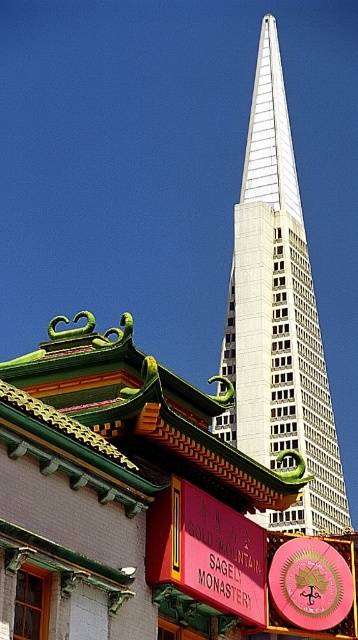
Question: Is white glass skyscraper at center bigger than red matte sign at center?

Choices:
 (A) yes
 (B) no

Answer: (A)

Question: Which of the following is the farthest from the observer?

Choices:
 (A) white glass skyscraper at center
 (B) pink glossy clock at center

Answer: (A)

Question: Considering the real-world distances, which object is farthest from the pink glossy clock at center?

Choices:
 (A) red matte sign at center
 (B) white glass skyscraper at center

Answer: (B)

Question: Is red matte sign at center further to the viewer compared to pink glossy clock at center?

Choices:
 (A) no
 (B) yes

Answer: (A)

Question: Which point appears closest to the camera in this image?

Choices:
 (A) (272, 221)
 (B) (318, 588)
 (C) (218, 518)

Answer: (C)

Question: Does white glass skyscraper at center have a smaller size compared to pink glossy clock at center?

Choices:
 (A) yes
 (B) no

Answer: (B)